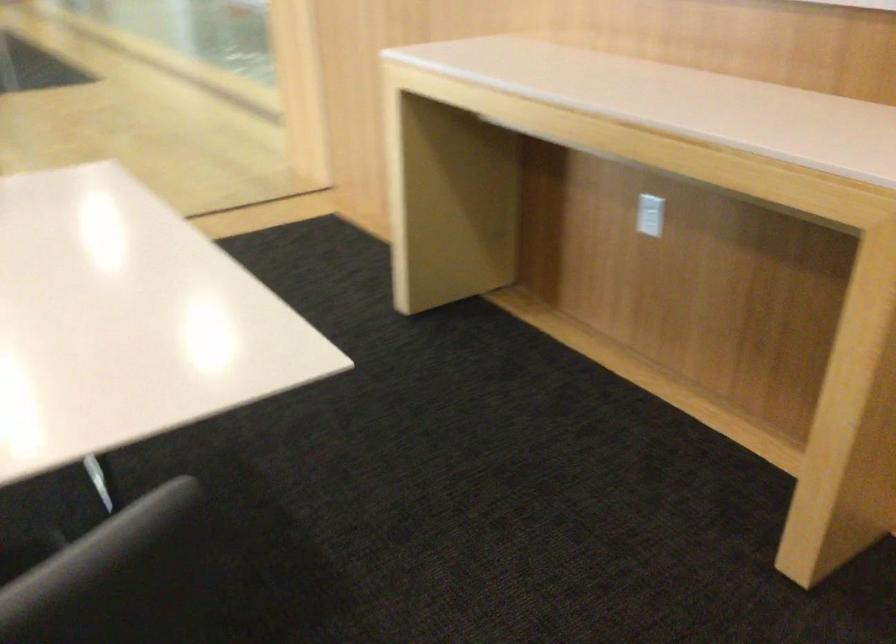
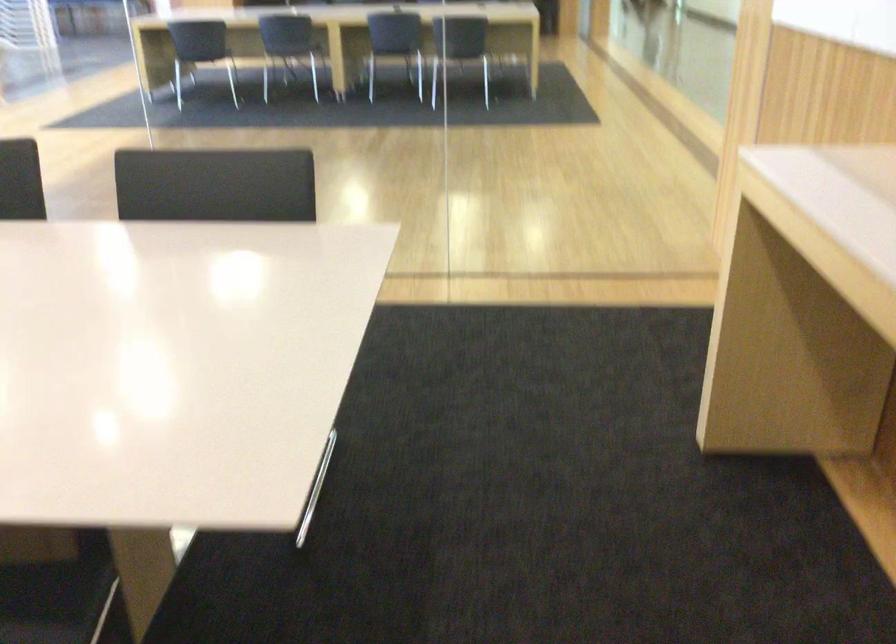
Question: The images are taken continuously from a first-person perspective. In which direction is your viewpoint rotating?

Choices:
 (A) Left
 (B) Right
 (C) Up
 (D) Down

Answer: (A)